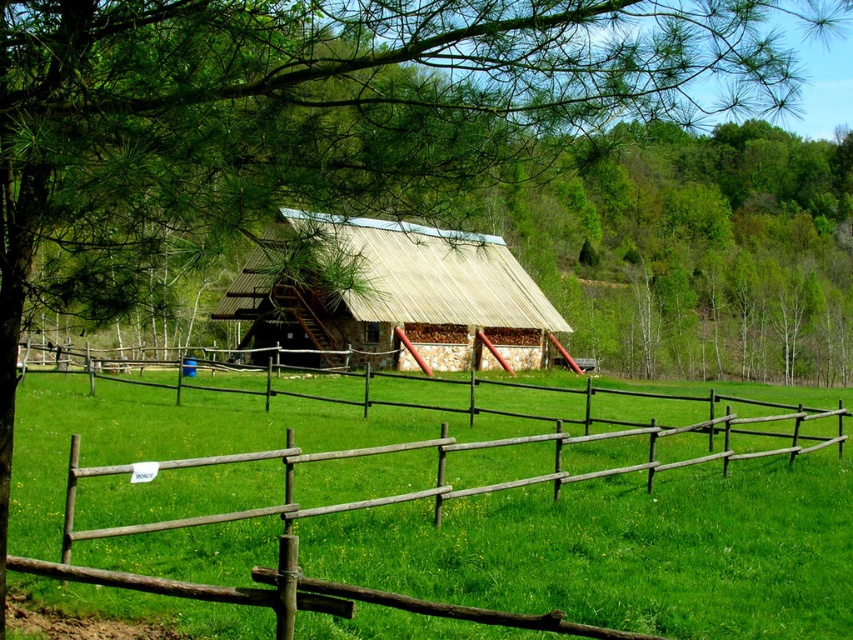
Is brown wooden fence at center further to camera compared to wooden thatched hut at center?

Yes, brown wooden fence at center is further from the viewer.

Between point (595, 486) and point (383, 273), which one is positioned behind?

The point (383, 273) is behind.

This screenshot has height=640, width=853. What do you see at coordinates (624, 548) in the screenshot?
I see `brown wooden fence at center` at bounding box center [624, 548].

At what (x,y) coordinates should I click in order to perform the action: click on brown wooden fence at center. Please return your answer as a coordinate pair (x, y). The image size is (853, 640). Looking at the image, I should click on (624, 548).